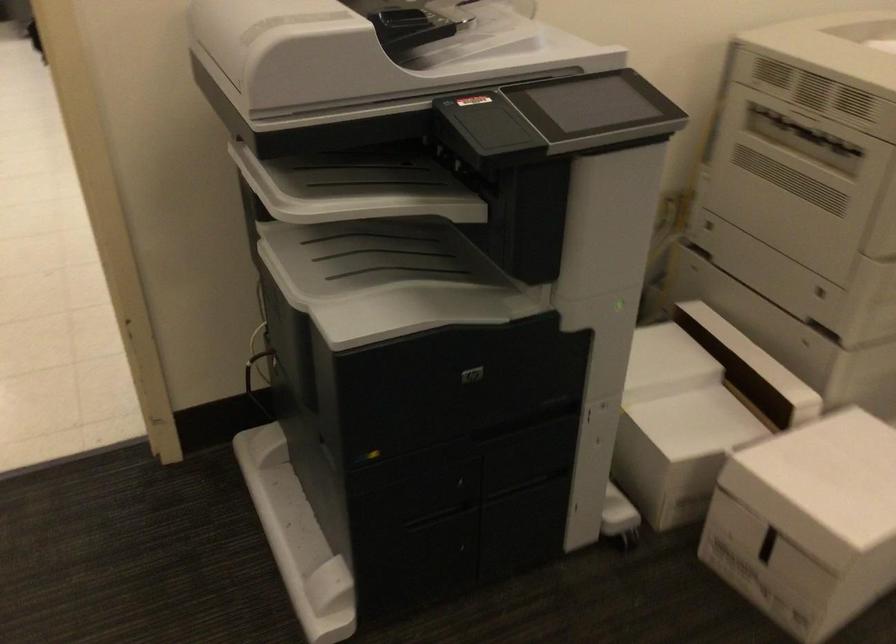
Locate an element on the screen. Image resolution: width=896 pixels, height=644 pixels. printer control panel is located at coordinates (597, 109).